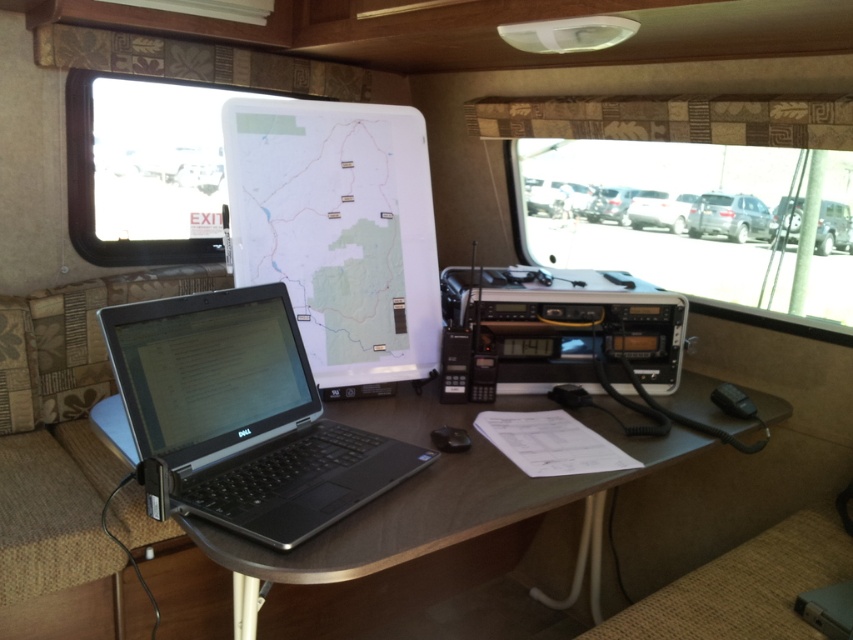
Question: Can you confirm if black plastic table at center is positioned above white plastic recreational vehicle at center?

Choices:
 (A) no
 (B) yes

Answer: (A)

Question: Considering the real-world distances, which object is farthest from the metallic silver recreational vehicle at center?

Choices:
 (A) silver/black plastic laptop at lower left
 (B) white matte map at center
 (C) satin silver suv at center
 (D) white plastic recreational vehicle at center

Answer: (A)

Question: Among these points, which one is nearest to the camera?

Choices:
 (A) (347, 451)
 (B) (378, 528)

Answer: (B)

Question: Does satin silver suv at center appear on the left side of metallic silver recreational vehicle at center?

Choices:
 (A) no
 (B) yes

Answer: (A)

Question: Can you confirm if black plastic table at center is bigger than metallic silver recreational vehicle at center?

Choices:
 (A) yes
 (B) no

Answer: (A)

Question: Which of the following is the closest to the observer?

Choices:
 (A) (685, 205)
 (B) (4, 417)
 (C) (393, 550)
 (D) (325, 268)

Answer: (C)